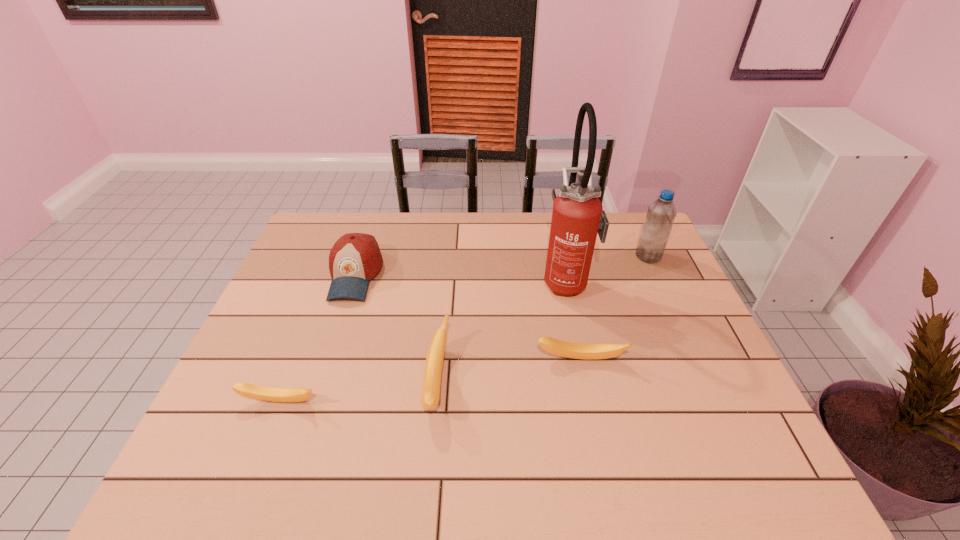
Where is `banana that stands as the closest to the fire extinguisher`? banana that stands as the closest to the fire extinguisher is located at coordinates (557, 347).

Where is `the closest banana to the second banana from right to left`? Image resolution: width=960 pixels, height=540 pixels. the closest banana to the second banana from right to left is located at coordinates (557, 347).

Identify the location of free space in the image that satisfies the following two spatial constraints: 1. at the stem of the fifth tallest object; 2. at the stem of the fourth object from right to left. (585, 380).

Where is `free space that satisfies the following two spatial constraints: 1. on the front side of the rightmost object; 2. at the nozzle of the tallest object`? free space that satisfies the following two spatial constraints: 1. on the front side of the rightmost object; 2. at the nozzle of the tallest object is located at coordinates (660, 281).

Locate an element on the screen. This screenshot has width=960, height=540. vacant space that satisfies the following two spatial constraints: 1. at the nozzle of the tallest object; 2. at the stem of the fifth tallest object is located at coordinates (585, 359).

At what (x,y) coordinates should I click in order to perform the action: click on free spot that satisfies the following two spatial constraints: 1. at the stem of the second banana from left to right; 2. at the stem of the shortest object. Please return your answer as a coordinate pair (x, y). Looking at the image, I should click on (435, 402).